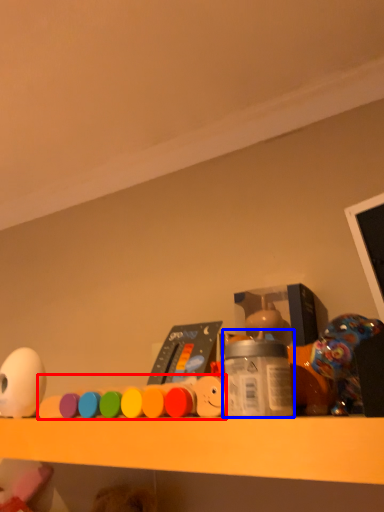
Question: Among these objects, which one is farthest to the camera, toy (highlighted by a red box) or bottle (highlighted by a blue box)?

Choices:
 (A) toy
 (B) bottle

Answer: (A)